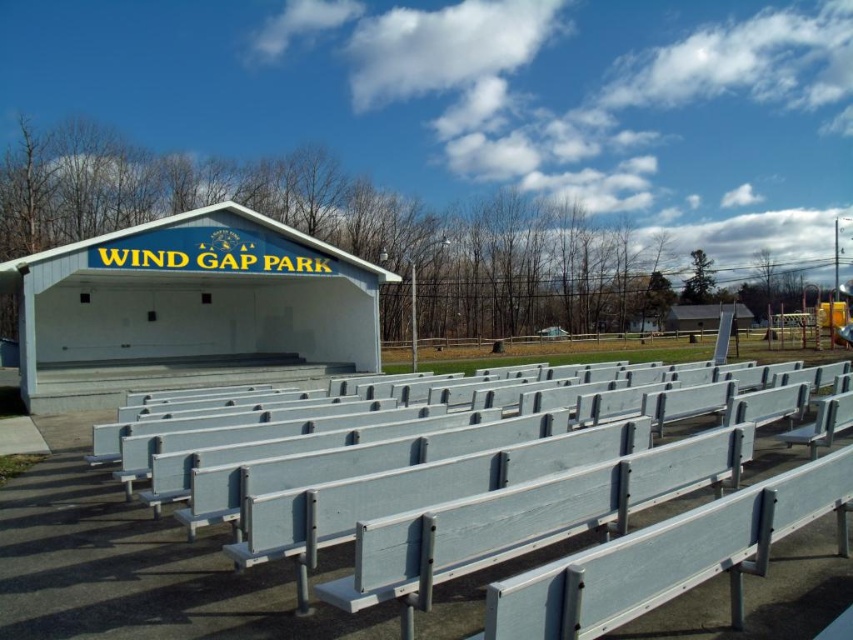
Question: Which point appears farthest from the camera in this image?

Choices:
 (A) coord(136,330)
 (B) coord(474,520)

Answer: (A)

Question: Which object appears closest to the camera in this image?

Choices:
 (A) white painted wood bench at lower center
 (B) white matte shelter at upper center

Answer: (A)

Question: Does white painted wood bench at lower center appear under white matte shelter at upper center?

Choices:
 (A) no
 (B) yes

Answer: (B)

Question: Does white painted wood bench at lower center have a smaller size compared to white matte shelter at upper center?

Choices:
 (A) no
 (B) yes

Answer: (B)

Question: Observing the image, what is the correct spatial positioning of white painted wood bench at lower center in reference to white matte shelter at upper center?

Choices:
 (A) below
 (B) above

Answer: (A)